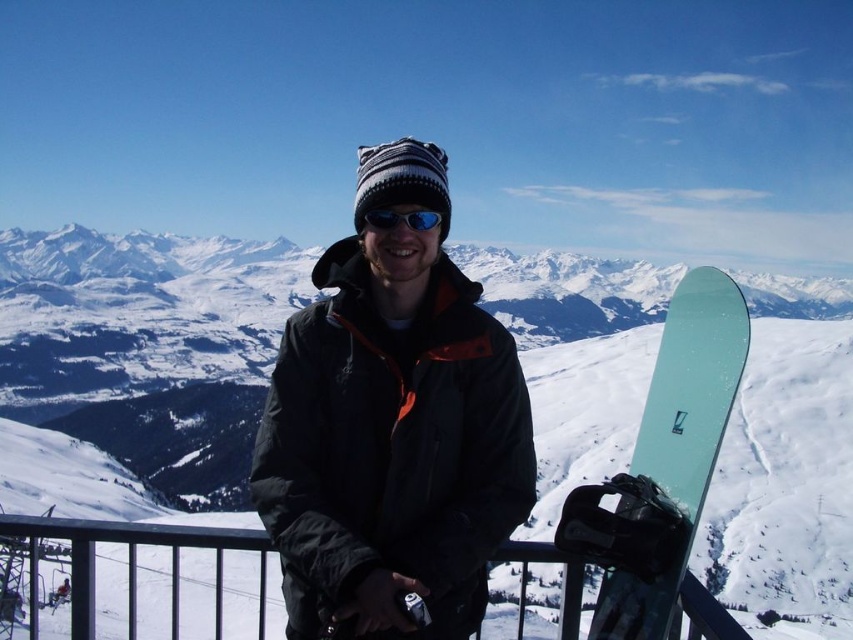
You are a photographer trying to capture a shot of the snowboard and the fence. Based on the scene, where should you position yourself to ensure both the white matte snowboard at center and the metallic black fence at lower left are in the frame?

Position yourself to the left of the metallic black fence at lower left so that the white matte snowboard at center, which is to the right of the metallic black fence at lower left, comes into view.

You are planning to place a small flag at the point closer to you between point (642, 413) and point (91, 547) in the snowy mountain landscape. Which point should you choose?

You should choose point (642, 413) because it is closer to you than point (91, 547).